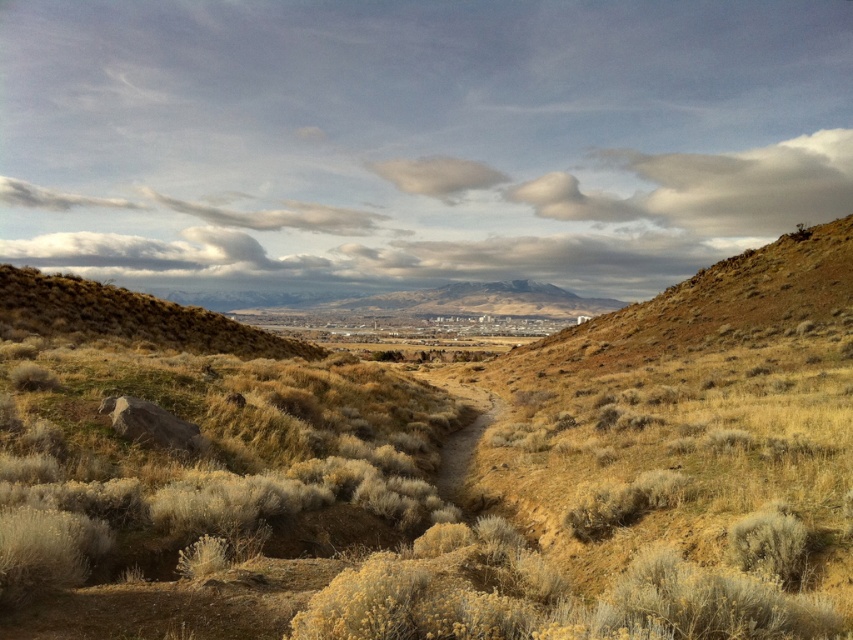
You are planning a photography session and want to capture both the white fluffy cloud at upper center and the brown dirt path at center in a single frame. Which object will appear larger in the photo?

The white fluffy cloud at upper center will appear larger in the photo because it is larger in size than the brown dirt path at center.

You are a hiker planning to follow the brown dirt path at center. You notice a white fluffy cloud at upper center. From your perspective, which object is located to the left of the other?

The white fluffy cloud at upper center is positioned on the left side of brown dirt path at center.

You are planning a photography session and want to capture both the white fluffy cloud at upper center and the brown dirt path at center in the same frame. Which object will appear wider in the photo?

The white fluffy cloud at upper center will appear wider in the photo because its width is larger than that of the brown dirt path at center.